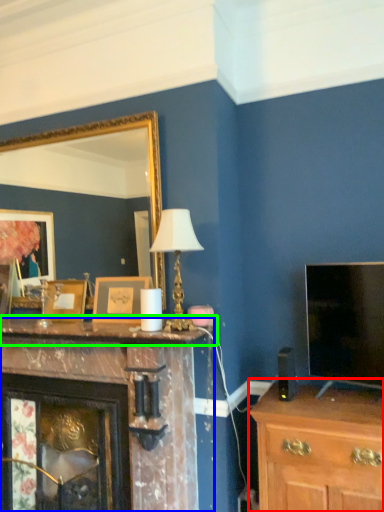
Question: Considering the real-world distances, which object is closest to chest of drawers (highlighted by a red box)? fireplace (highlighted by a blue box) or mantle (highlighted by a green box).

Choices:
 (A) fireplace
 (B) mantle

Answer: (B)